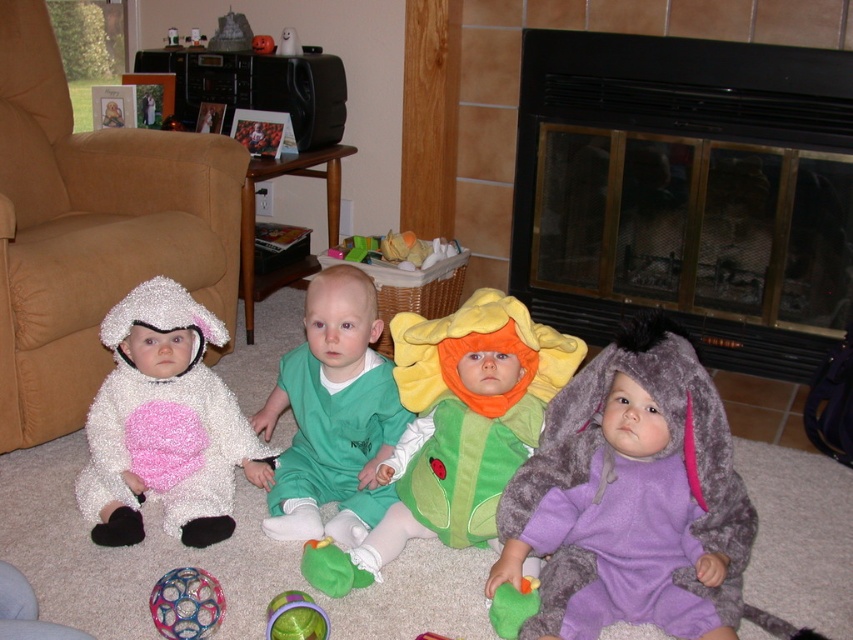
Question: Is purple fuzzy onesie at lower right bigger than green fuzzy toy at lower right?

Choices:
 (A) no
 (B) yes

Answer: (B)

Question: Which object is closer to the camera taking this photo?

Choices:
 (A) green fabric flower at center
 (B) translucent plastic ball at lower left
 (C) fluffy white costume at left

Answer: (B)

Question: Estimate the real-world distances between objects in this image. Which object is farther from the brown fabric armchair at left?

Choices:
 (A) black glass fireplace at center
 (B) green fuzzy toy at lower right

Answer: (B)

Question: Among these objects, which one is nearest to the camera?

Choices:
 (A) fluffy white costume at left
 (B) black glass fireplace at center

Answer: (A)

Question: Can you confirm if green fabric onesie at center is wider than translucent plastic ball at center?

Choices:
 (A) no
 (B) yes

Answer: (B)

Question: Does black glass fireplace at center appear over green fuzzy toy at lower right?

Choices:
 (A) yes
 (B) no

Answer: (A)